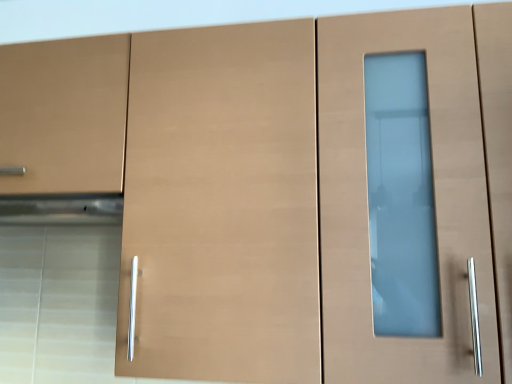
The height and width of the screenshot is (384, 512). What do you see at coordinates (64, 115) in the screenshot? I see `matte wood drawer at left` at bounding box center [64, 115].

This screenshot has width=512, height=384. I want to click on matte wood drawer at left, so click(x=64, y=115).

What is the approximate width of satin silver exhaust hood at left?

It is 12.86 inches.

Image resolution: width=512 pixels, height=384 pixels. In order to click on satin silver exhaust hood at left in this screenshot , I will do `click(61, 209)`.

This screenshot has height=384, width=512. What do you see at coordinates (61, 209) in the screenshot?
I see `satin silver exhaust hood at left` at bounding box center [61, 209].

You are a GUI agent. You are given a task and a screenshot of the screen. Output one action in this format:
    pyautogui.click(x=<x>, y=<y>)
    Task: Click on the matte wood drawer at left
    This screenshot has height=384, width=512.
    Given the screenshot: What is the action you would take?
    pyautogui.click(x=64, y=115)

Visually, is matte wood drawer at left positioned to the left or to the right of satin silver exhaust hood at left?

Clearly, matte wood drawer at left is on the left of satin silver exhaust hood at left in the image.

Considering the relative positions of matte wood drawer at left and satin silver exhaust hood at left in the image provided, is matte wood drawer at left in front of satin silver exhaust hood at left?

Yes, it is in front of satin silver exhaust hood at left.

Considering the points (10, 62) and (92, 197), which point is behind, point (10, 62) or point (92, 197)?

The point (10, 62) is behind.

From the image's perspective, would you say matte wood drawer at left is shown under satin silver exhaust hood at left?

Incorrect, from the image's perspective, matte wood drawer at left is higher than satin silver exhaust hood at left.

From a real-world perspective, is matte wood drawer at left above or below satin silver exhaust hood at left?

From a real-world perspective, matte wood drawer at left is physically above satin silver exhaust hood at left.

Considering the relative sizes of matte wood drawer at left and satin silver exhaust hood at left in the image provided, is matte wood drawer at left wider than satin silver exhaust hood at left?

Yes, matte wood drawer at left is wider than satin silver exhaust hood at left.

In terms of height, does matte wood drawer at left look taller or shorter compared to satin silver exhaust hood at left?

Clearly, matte wood drawer at left is taller compared to satin silver exhaust hood at left.

Considering the relative sizes of matte wood drawer at left and satin silver exhaust hood at left in the image provided, is matte wood drawer at left smaller than satin silver exhaust hood at left?

No, matte wood drawer at left is not smaller than satin silver exhaust hood at left.

Would you say matte wood drawer at left contains satin silver exhaust hood at left?

That's incorrect, satin silver exhaust hood at left is not inside matte wood drawer at left.

Consider the image. Are matte wood drawer at left and satin silver exhaust hood at left beside each other?

No.

Could you tell me if matte wood drawer at left is turned towards satin silver exhaust hood at left?

No, matte wood drawer at left does not turn towards satin silver exhaust hood at left.

How different are the orientations of matte wood drawer at left and satin silver exhaust hood at left in degrees?

matte wood drawer at left and satin silver exhaust hood at left are facing 2.26e-06 degrees away from each other.

Where is `drawer in front of the satin silver exhaust hood at left`? drawer in front of the satin silver exhaust hood at left is located at coordinates (64, 115).

Considering the positions of objects satin silver exhaust hood at left and matte wood drawer at left in the image provided, who is more to the right, satin silver exhaust hood at left or matte wood drawer at left?

satin silver exhaust hood at left is more to the right.

Which object is further away from the camera taking this photo, satin silver exhaust hood at left or matte wood drawer at left?

Positioned behind is satin silver exhaust hood at left.

Considering the points (32, 200) and (0, 115), which point is in front, point (32, 200) or point (0, 115)?

The point (0, 115) is in front.

From the image's perspective, between satin silver exhaust hood at left and matte wood drawer at left, who is located below?

From the image's view, satin silver exhaust hood at left is below.

From a real-world perspective, does satin silver exhaust hood at left stand above matte wood drawer at left?

Actually, satin silver exhaust hood at left is physically below matte wood drawer at left in the real world.

Between satin silver exhaust hood at left and matte wood drawer at left, which one has larger width?

matte wood drawer at left.

Considering the relative sizes of satin silver exhaust hood at left and matte wood drawer at left in the image provided, is satin silver exhaust hood at left taller than matte wood drawer at left?

No.

Who is smaller, satin silver exhaust hood at left or matte wood drawer at left?

satin silver exhaust hood at left.

Is satin silver exhaust hood at left not within matte wood drawer at left?

Yes, satin silver exhaust hood at left is located beyond the bounds of matte wood drawer at left.

Is satin silver exhaust hood at left in contact with matte wood drawer at left?

satin silver exhaust hood at left and matte wood drawer at left are not in contact.

Is satin silver exhaust hood at left oriented away from matte wood drawer at left?

No, satin silver exhaust hood at left is not facing away from matte wood drawer at left.

What's the angular difference between satin silver exhaust hood at left and matte wood drawer at left's facing directions?

2.26e-06 degrees separate the facing orientations of satin silver exhaust hood at left and matte wood drawer at left.

The height and width of the screenshot is (384, 512). I want to click on exhaust hood on the right of matte wood drawer at left, so click(61, 209).

The image size is (512, 384). What are the coordinates of `drawer above the satin silver exhaust hood at left (from a real-world perspective)` in the screenshot? It's located at (64, 115).

Where is `exhaust hood behind the matte wood drawer at left`? This screenshot has width=512, height=384. exhaust hood behind the matte wood drawer at left is located at coordinates (61, 209).